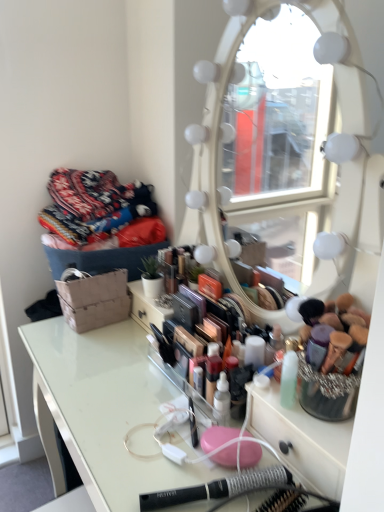
Question: From a real-world perspective, is knitted fabric pile at upper left positioned above or below black plastic hairbrush at lower center?

Choices:
 (A) above
 (B) below

Answer: (A)

Question: Is knitted fabric pile at upper left to the left or to the right of black plastic hairbrush at lower center in the image?

Choices:
 (A) left
 (B) right

Answer: (A)

Question: Which of these objects is positioned closest to the clear acrylic table at center?

Choices:
 (A) black plastic hairbrush at lower center
 (B) knitted fabric pile at upper left

Answer: (A)

Question: Estimate the real-world distances between objects in this image. Which object is farther from the knitted fabric pile at upper left?

Choices:
 (A) clear acrylic table at center
 (B) black plastic hairbrush at lower center

Answer: (B)